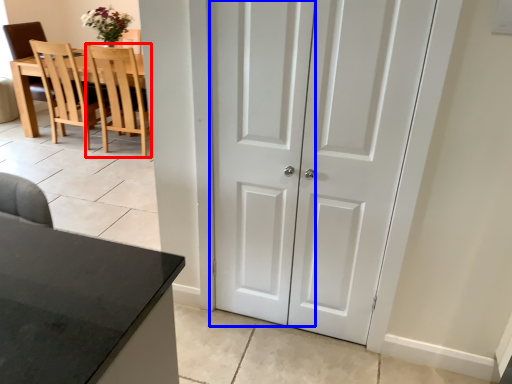
Question: Which point is closer to the camera, chair (highlighted by a red box) or screen door (highlighted by a blue box)?

Choices:
 (A) chair
 (B) screen door

Answer: (B)